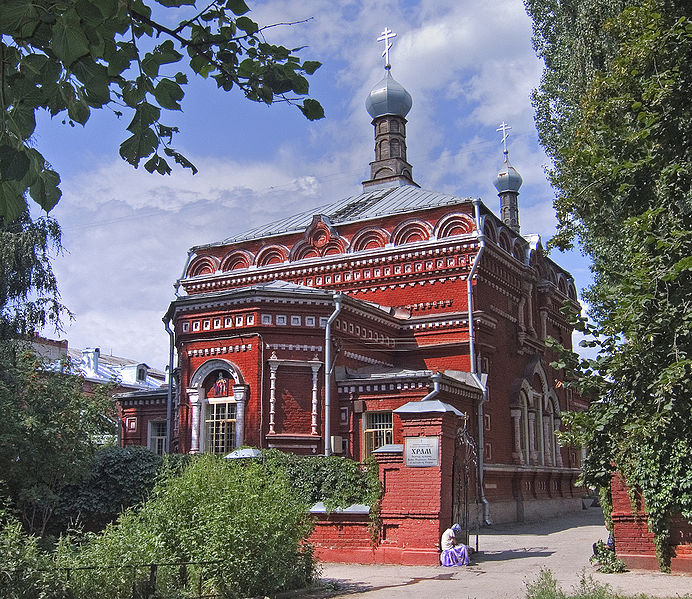
This screenshot has width=692, height=599. What are the coordinates of `window` in the screenshot? It's located at (226, 438).